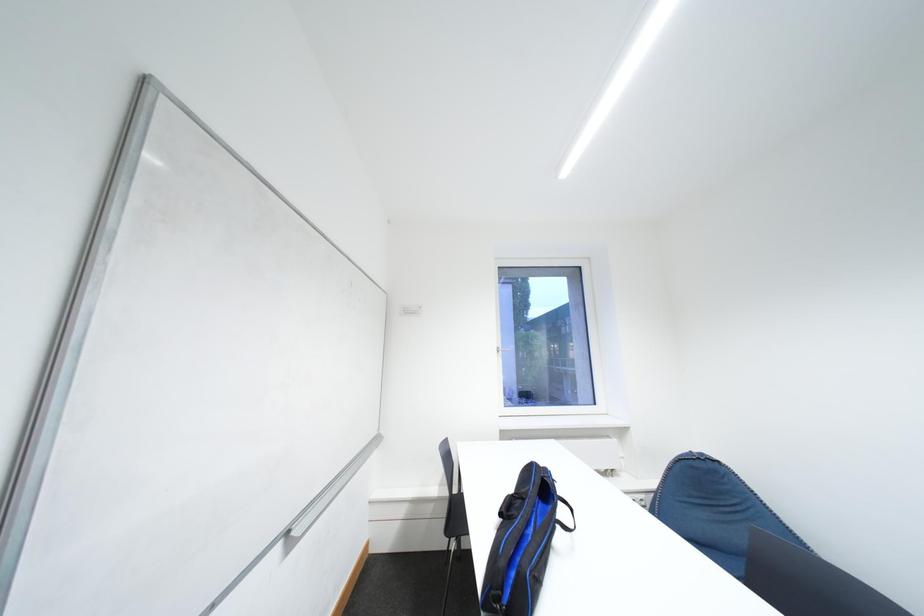
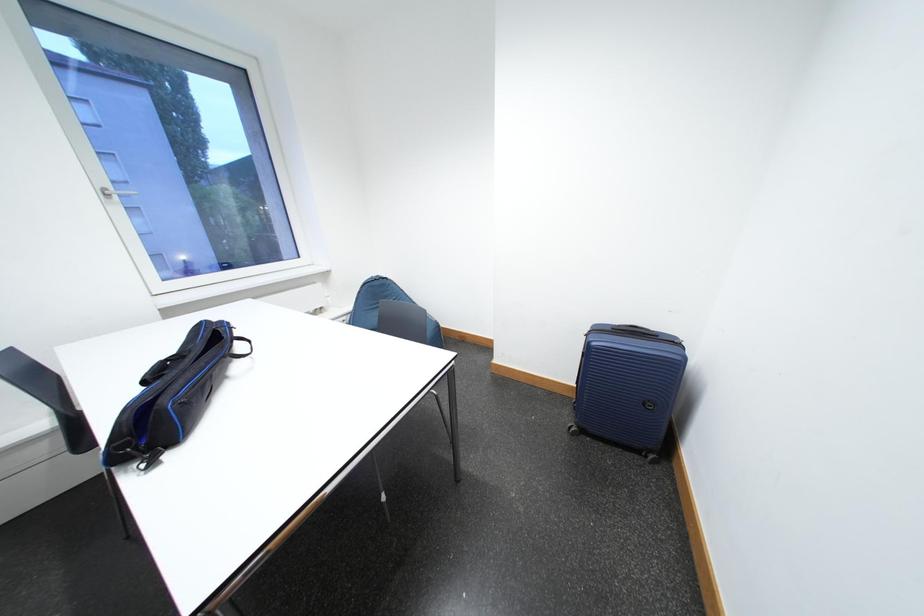
How did the camera likely rotate?

The camera rotated toward right-down.